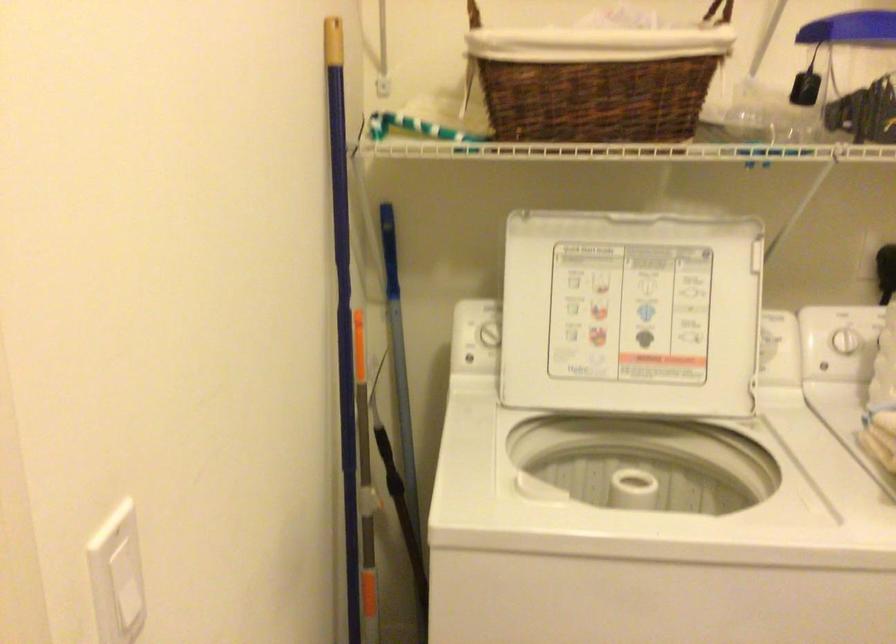
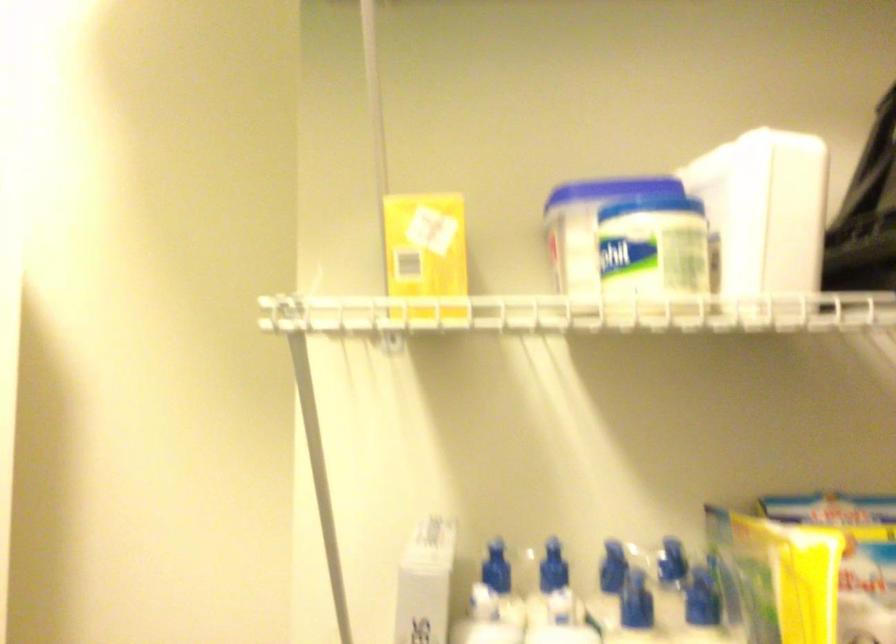
Question: Based on the continuous images, in which direction is the camera rotating? Reply with the corresponding letter.

Choices:
 (A) Left
 (B) Right
 (C) Up
 (D) Down

Answer: (B)